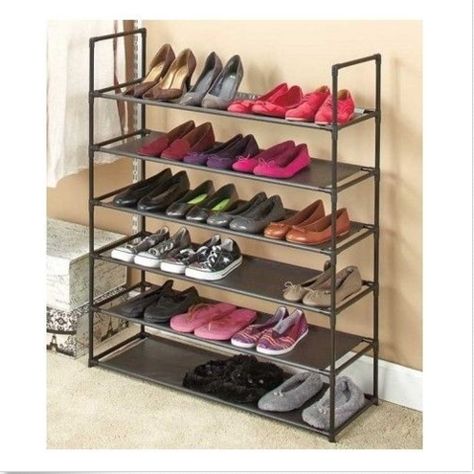
Where is `shelves with shoes on them`? This screenshot has height=474, width=474. shelves with shoes on them is located at coordinates (166, 382), (199, 337), (239, 288), (253, 236), (309, 178), (247, 116).